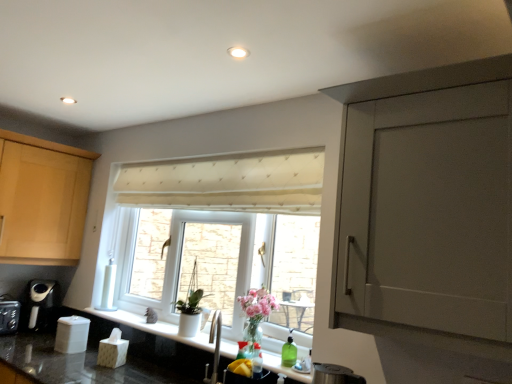
Question: Can you confirm if clear glass vase at lower center is bigger than black plastic coffee machine at lower left?

Choices:
 (A) yes
 (B) no

Answer: (B)

Question: Is clear glass vase at lower center facing away from black plastic coffee machine at lower left?

Choices:
 (A) yes
 (B) no

Answer: (B)

Question: Can you confirm if clear glass vase at lower center is thinner than black plastic coffee machine at lower left?

Choices:
 (A) yes
 (B) no

Answer: (A)

Question: Is clear glass vase at lower center to the left of black plastic coffee machine at lower left from the viewer's perspective?

Choices:
 (A) yes
 (B) no

Answer: (B)

Question: Is clear glass vase at lower center not close to black plastic coffee machine at lower left?

Choices:
 (A) no
 (B) yes

Answer: (B)

Question: From the image's perspective, does clear glass vase at lower center appear higher than black plastic coffee machine at lower left?

Choices:
 (A) yes
 (B) no

Answer: (A)

Question: From the image's perspective, is black plastic toaster at lower left over black granite countertop at lower center?

Choices:
 (A) yes
 (B) no

Answer: (B)

Question: From a real-world perspective, is black plastic toaster at lower left on black granite countertop at lower center?

Choices:
 (A) no
 (B) yes

Answer: (A)

Question: From a real-world perspective, is black plastic toaster at lower left positioned under black granite countertop at lower center based on gravity?

Choices:
 (A) yes
 (B) no

Answer: (A)

Question: Considering the relative sizes of black plastic toaster at lower left and black granite countertop at lower center in the image provided, is black plastic toaster at lower left thinner than black granite countertop at lower center?

Choices:
 (A) no
 (B) yes

Answer: (A)

Question: Is black plastic toaster at lower left turned away from black granite countertop at lower center?

Choices:
 (A) no
 (B) yes

Answer: (A)

Question: Could you tell me if black plastic toaster at lower left is turned towards black granite countertop at lower center?

Choices:
 (A) yes
 (B) no

Answer: (A)

Question: Is cream quilted curtain at center wider than clear glass vase at lower center?

Choices:
 (A) yes
 (B) no

Answer: (A)